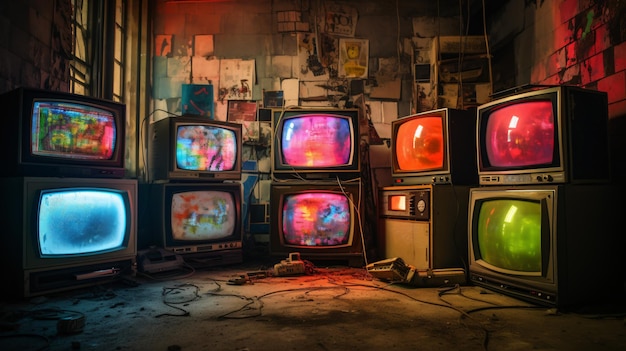
The width and height of the screenshot is (626, 351). Find the location of `window panes`. window panes is located at coordinates (80, 18), (77, 43), (72, 84), (118, 22), (118, 46), (118, 80).